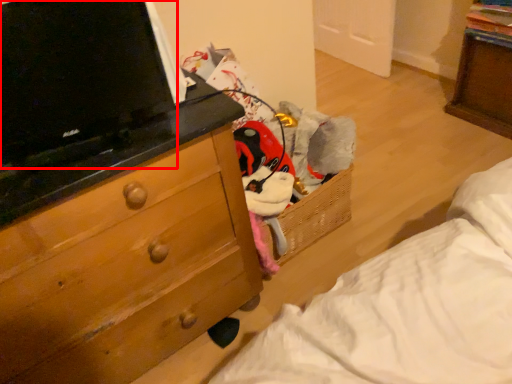
Question: From the image's perspective, where is computer (annotated by the red box) located relative to chest of drawers?

Choices:
 (A) below
 (B) above

Answer: (B)